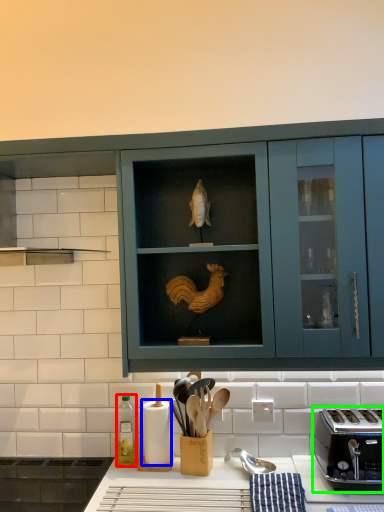
Question: Estimate the real-world distances between objects in this image. Which object is farther from bottle (highlighted by a red box), paper towel (highlighted by a blue box) or toaster (highlighted by a green box)?

Choices:
 (A) paper towel
 (B) toaster

Answer: (B)